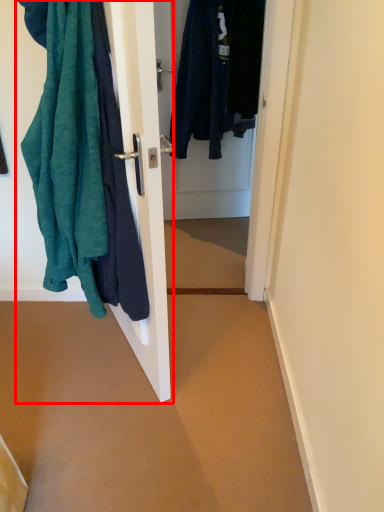
Question: From the image's perspective, what is the correct spatial positioning of closet (annotated by the red box) in reference to door?

Choices:
 (A) above
 (B) below

Answer: (B)